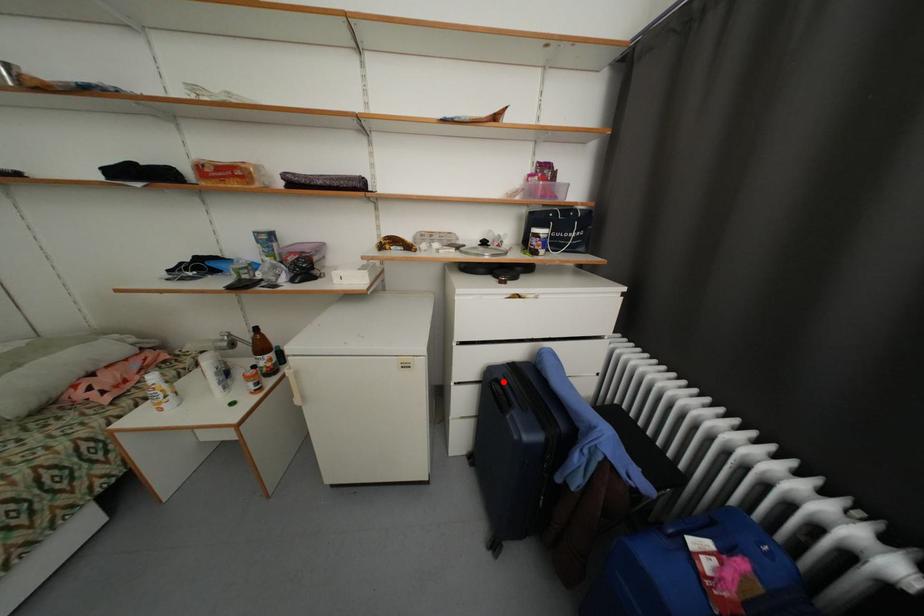
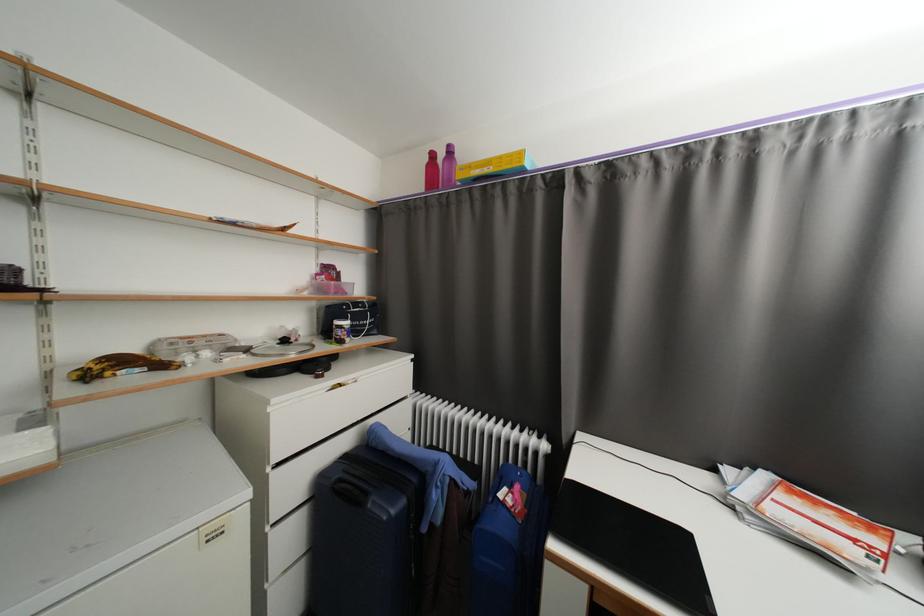
Question: I am providing you with two images of the same scene from different viewpoints. A red point is marked on the first image. At the location where the point appears in image 1, is it still visible in image 2?

Choices:
 (A) Yes
 (B) No

Answer: (A)